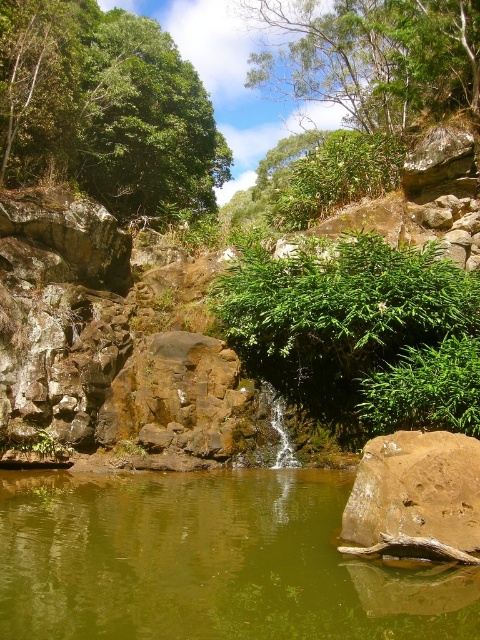
Who is higher up, green leafy tree at upper left or brown rough rock at center?

green leafy tree at upper left is above.

Where is `green leafy tree at upper left`? The image size is (480, 640). green leafy tree at upper left is located at coordinates click(x=105, y=108).

Identify the location of green leafy tree at upper left. Image resolution: width=480 pixels, height=640 pixels. (105, 108).

Between greenish-brown liquid at center and brown rough rock at center, which one has more height?

greenish-brown liquid at center

Does point (36, 486) come in front of point (395, 468)?

No.

Which is in front, point (132, 637) or point (410, 522)?

Point (132, 637) is in front.

You are a GUI agent. You are given a task and a screenshot of the screen. Output one action in this format:
    pyautogui.click(x=<x>, y=<y>)
    Task: Click on the greenish-brown liquid at center
    
    Given the screenshot: What is the action you would take?
    pyautogui.click(x=206, y=561)

Who is taller, greenish-brown liquid at center or green leafy tree at upper center?

With more height is green leafy tree at upper center.

Is greenish-brown liquid at center taller than green leafy tree at upper center?

Incorrect, greenish-brown liquid at center's height is not larger of green leafy tree at upper center's.

Which is behind, point (389, 588) or point (376, 100)?

Point (376, 100)

Where is `greenish-brown liquid at center`? This screenshot has width=480, height=640. greenish-brown liquid at center is located at coordinates (206, 561).